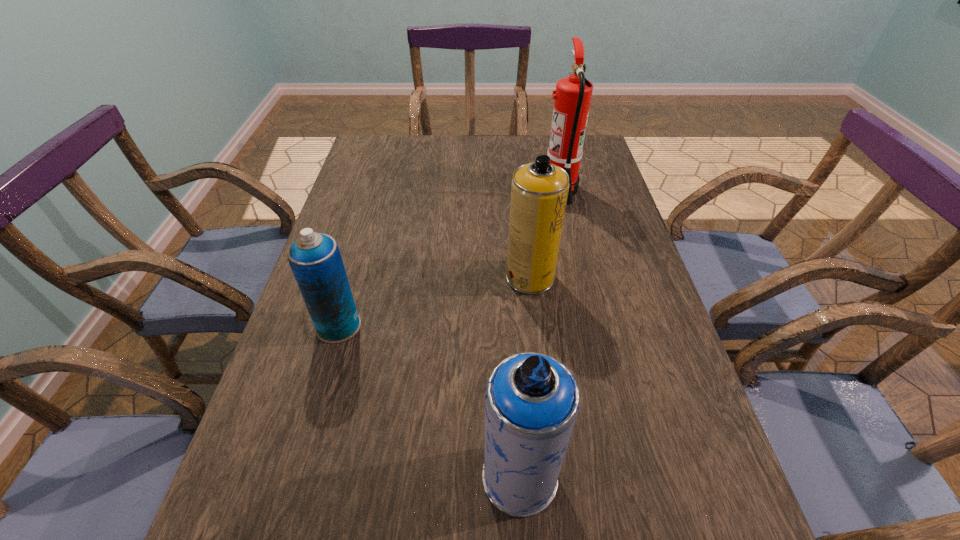
I want to click on vacant space in between the tallest object and the nearest object, so click(x=540, y=333).

Where is `empty location between the nearest aerosol can and the shortest aerosol can`? empty location between the nearest aerosol can and the shortest aerosol can is located at coordinates (429, 402).

You are a GUI agent. You are given a task and a screenshot of the screen. Output one action in this format:
    pyautogui.click(x=<x>, y=<y>)
    Task: Click on the free space between the tallest object and the second farthest aerosol can
    The height and width of the screenshot is (540, 960).
    Given the screenshot: What is the action you would take?
    pyautogui.click(x=449, y=258)

The height and width of the screenshot is (540, 960). I want to click on free spot between the nearest aerosol can and the shortest aerosol can, so click(429, 402).

This screenshot has height=540, width=960. I want to click on unoccupied area between the leftmost aerosol can and the nearest aerosol can, so click(429, 402).

Locate which object ranks third in proximity to the nearest object. Please provide its 2D coordinates. Your answer should be formatted as a tuple, i.e. [(x, y)], where the tuple contains the x and y coordinates of a point satisfying the conditions above.

[(573, 94)]

Point out which object is positioned as the nearest to the farthest aerosol can. Please provide its 2D coordinates. Your answer should be formatted as a tuple, i.e. [(x, y)], where the tuple contains the x and y coordinates of a point satisfying the conditions above.

[(573, 94)]

Find the location of a particular element. The height and width of the screenshot is (540, 960). aerosol can that stands as the second closest to the second farthest object is located at coordinates (532, 400).

Identify which aerosol can is located as the nearest to the tallest object. Please provide its 2D coordinates. Your answer should be formatted as a tuple, i.e. [(x, y)], where the tuple contains the x and y coordinates of a point satisfying the conditions above.

[(539, 191)]

Image resolution: width=960 pixels, height=540 pixels. Find the location of `blank area in the image that satisfies the following two spatial constraints: 1. at the nozzle of the tallest object; 2. on the front side of the leftmost aerosol can`. blank area in the image that satisfies the following two spatial constraints: 1. at the nozzle of the tallest object; 2. on the front side of the leftmost aerosol can is located at coordinates (591, 326).